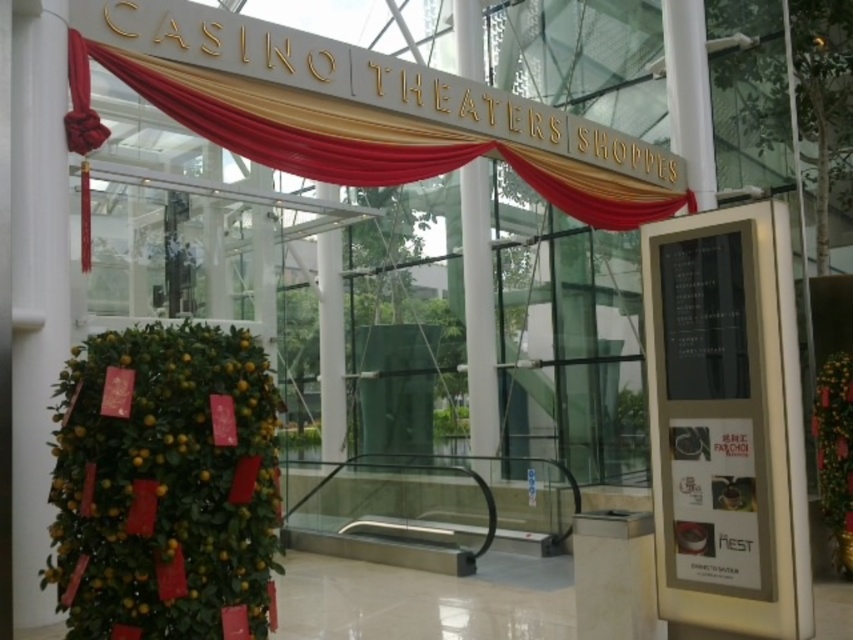
Describe the element at coordinates (726, 422) in the screenshot. The image size is (853, 640). I see `metallic gold sign at right` at that location.

Is metallic gold sign at right positioned behind gold satin curtain at upper center?

No, it is not.

Which is in front, point (695, 266) or point (268, 138)?

Point (695, 266) is in front.

The image size is (853, 640). Find the location of `metallic gold sign at right`. metallic gold sign at right is located at coordinates (726, 422).